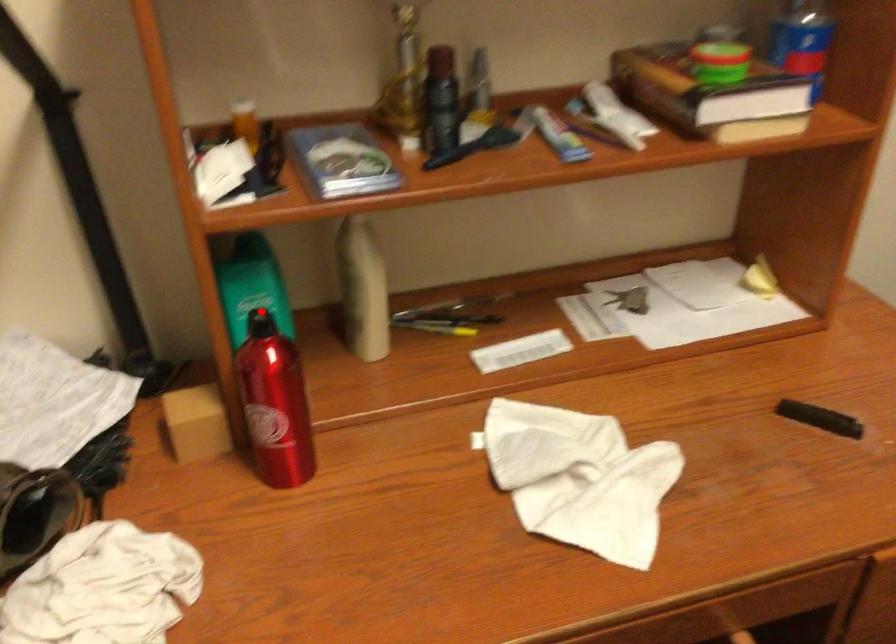
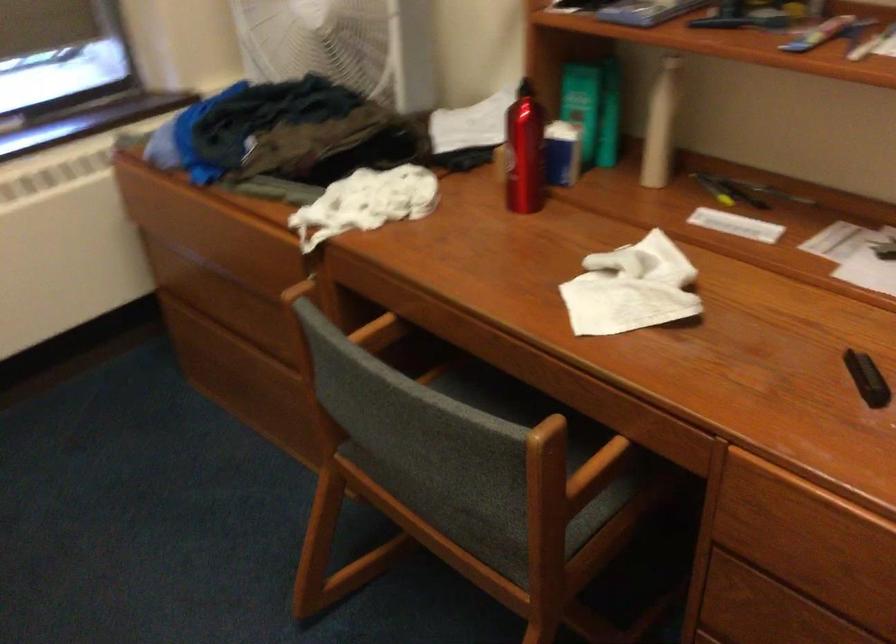
Question: I am providing you with two images of the same scene from different viewpoints. Given a red point in image1, look at the same physical point in image2. Is it:

Choices:
 (A) Closer to the viewpoint
 (B) Farther from the viewpoint

Answer: (B)